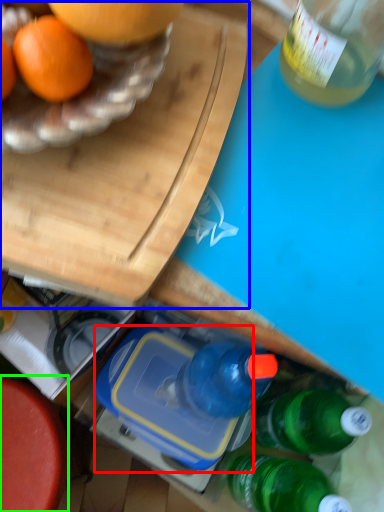
Question: Considering the real-world distances, which object is farthest from lunch box (highlighted by a red box)? cutting board (highlighted by a blue box) or round table (highlighted by a green box)?

Choices:
 (A) cutting board
 (B) round table

Answer: (A)